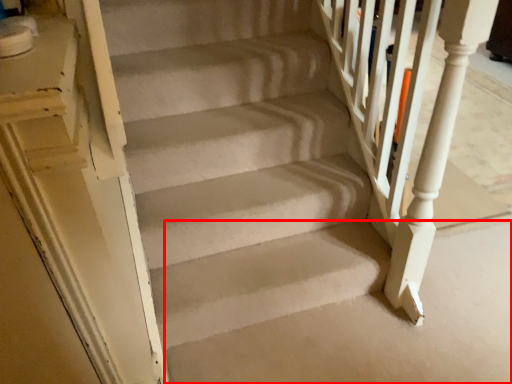
Question: From the image's perspective, what is the correct spatial relationship of concrete (annotated by the red box) in relation to rail?

Choices:
 (A) above
 (B) below

Answer: (B)